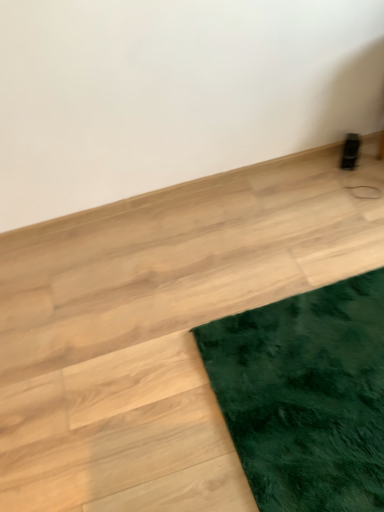
What do you see at coordinates (159, 327) in the screenshot? The width and height of the screenshot is (384, 512). I see `wooden floor at lower right` at bounding box center [159, 327].

What are the coordinates of `wooden floor at lower right` in the screenshot? It's located at (159, 327).

What is the approximate width of wooden floor at lower right?

4.32 feet.

Locate an element on the screen. wooden floor at lower right is located at coordinates (159, 327).